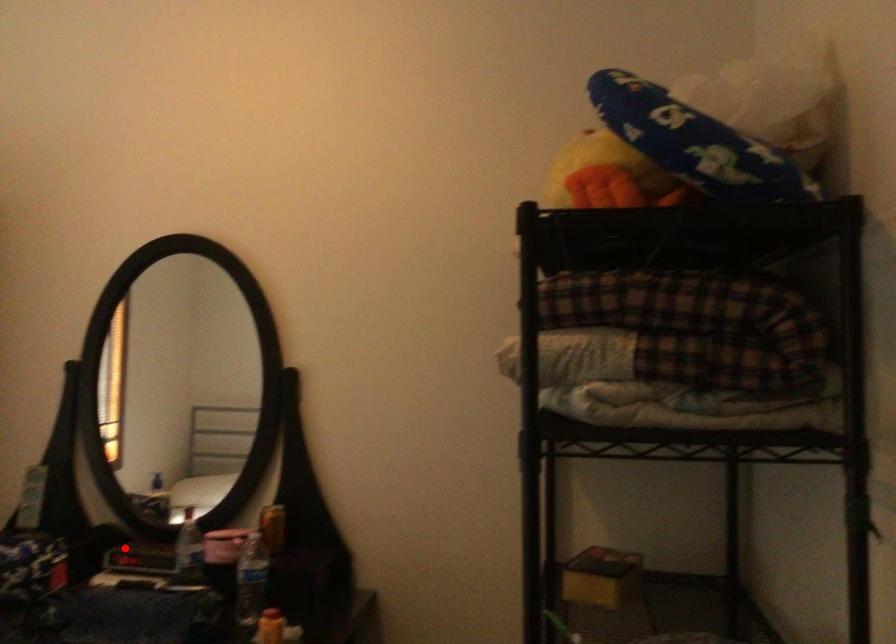
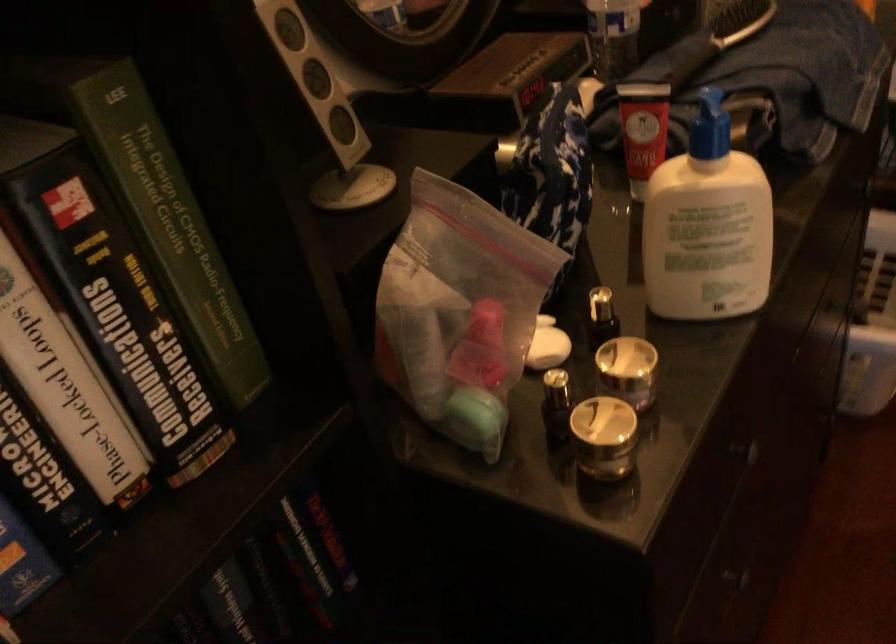
Question: I am providing you with two images of the same scene from different viewpoints. A red point is shown in image1. For the corresponding object point in image2, is it positioned nearer or farther from the camera?

Choices:
 (A) Nearer
 (B) Farther

Answer: (A)